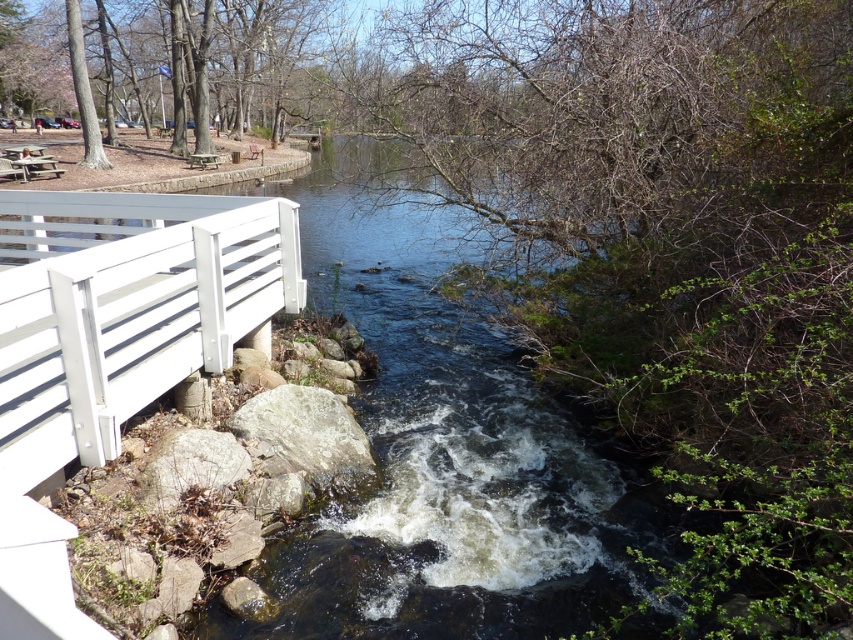
Question: In this image, where is gray rough rock at lower left located relative to wooden picnic table at left?

Choices:
 (A) above
 (B) below

Answer: (B)

Question: Considering the real-world distances, which object is farthest from the wooden picnic table at left?

Choices:
 (A) gray rough rock at lower left
 (B) white matte bridge at left
 (C) gray rough rock at lower center

Answer: (A)

Question: Which point is farther to the camera?

Choices:
 (A) wooden picnic table at left
 (B) gray rough rock at lower center

Answer: (A)

Question: Is gray rough rock at lower center bigger than gray rough rock at lower left?

Choices:
 (A) yes
 (B) no

Answer: (A)

Question: Does gray rough rock at lower center have a lesser width compared to wooden picnic table at left?

Choices:
 (A) yes
 (B) no

Answer: (B)

Question: Which point is closer to the camera taking this photo?

Choices:
 (A) (21, 154)
 (B) (62, 360)

Answer: (B)